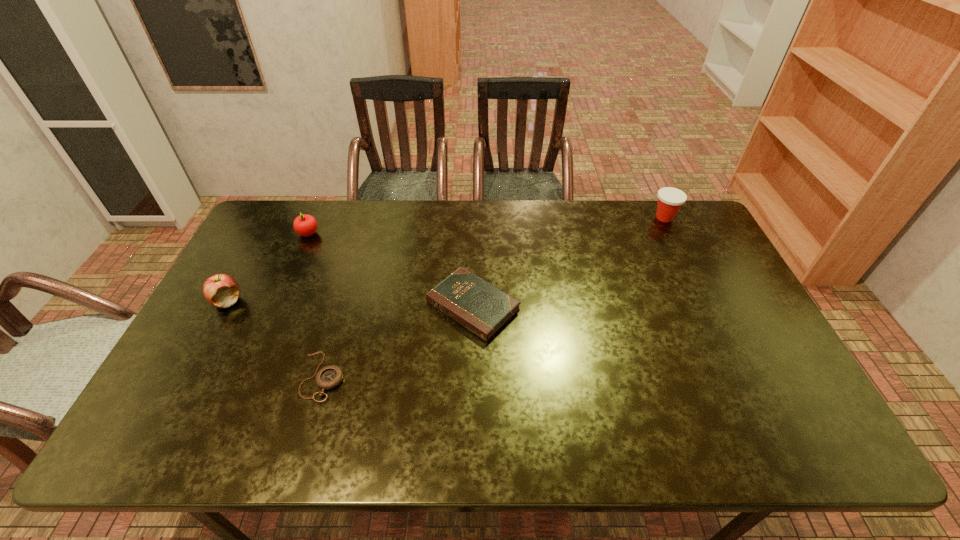
At what (x,y) coordinates should I click in order to perform the action: click on vacant space located on the left of the rightmost object. Please return your answer as a coordinate pair (x, y). Looking at the image, I should click on pos(620,218).

Identify the location of vacant region located on the front of the leftmost object. The width and height of the screenshot is (960, 540). (149, 446).

Where is `free region located on the right of the farther apple`? The height and width of the screenshot is (540, 960). free region located on the right of the farther apple is located at coordinates (357, 233).

At what (x,y) coordinates should I click in order to perform the action: click on vacant space situated 0.130m on the right of the Bible. Please return your answer as a coordinate pair (x, y). Looking at the image, I should click on (564, 306).

Where is `free point located 0.170m on the left of the pocket watch`? This screenshot has height=540, width=960. free point located 0.170m on the left of the pocket watch is located at coordinates (233, 376).

Where is `Dixie cup that is at the far edge`? Dixie cup that is at the far edge is located at coordinates (670, 200).

Find the location of `apple that is at the far edge`. apple that is at the far edge is located at coordinates (305, 225).

I want to click on object located at the right edge, so click(x=670, y=200).

Where is `object positioned at the far left corner`? This screenshot has width=960, height=540. object positioned at the far left corner is located at coordinates (x=305, y=225).

At what (x,y) coordinates should I click in order to perform the action: click on object at the far right corner. Please return your answer as a coordinate pair (x, y). The height and width of the screenshot is (540, 960). Looking at the image, I should click on (670, 200).